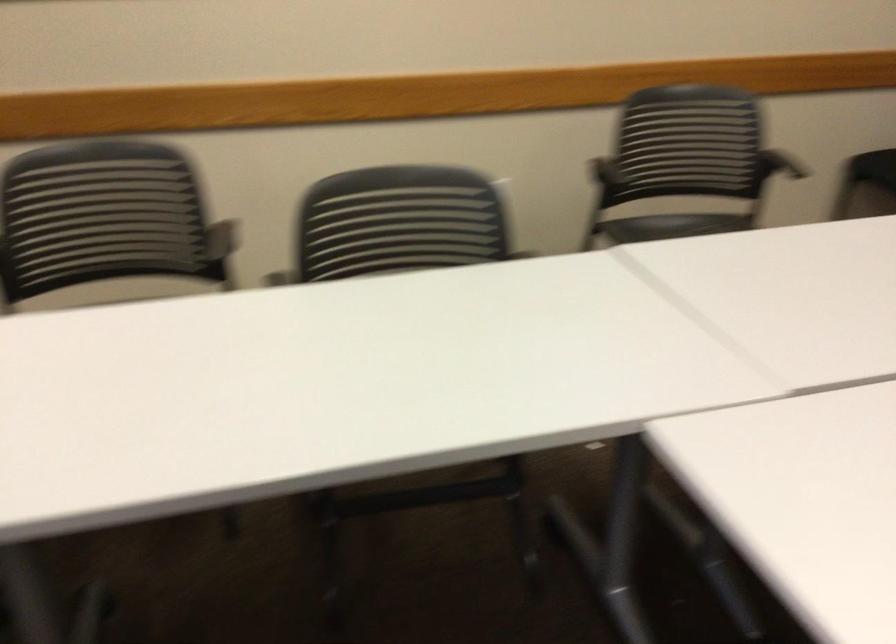
Find where to sit the black chair sitting surface. Please return your answer as a coordinate pair (x, y).

(677, 223)